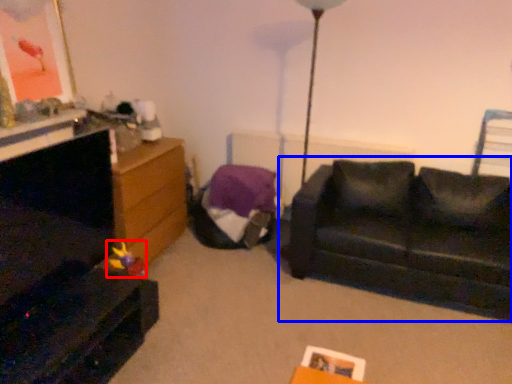
Question: Among these objects, which one is nearest to the camera, toy (highlighted by a red box) or studio couch (highlighted by a blue box)?

Choices:
 (A) toy
 (B) studio couch

Answer: (B)